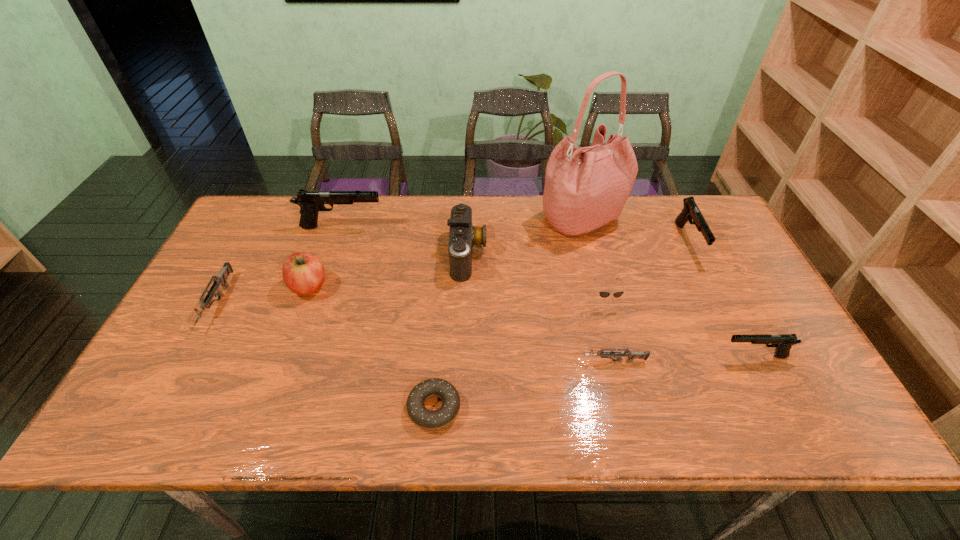
Where is `gun that is the fourth closest one to the apple`? The height and width of the screenshot is (540, 960). gun that is the fourth closest one to the apple is located at coordinates (783, 342).

Where is `black gun that is the second closest to the second shortest gun`? This screenshot has width=960, height=540. black gun that is the second closest to the second shortest gun is located at coordinates (783, 342).

Image resolution: width=960 pixels, height=540 pixels. I want to click on black gun that can be found as the second closest to the second biggest black gun, so [x=311, y=202].

Locate an element on the screen. vacant space that satisfies the following two spatial constraints: 1. on the front side of the tallest object; 2. at the aiming end of the second tallest object is located at coordinates (584, 227).